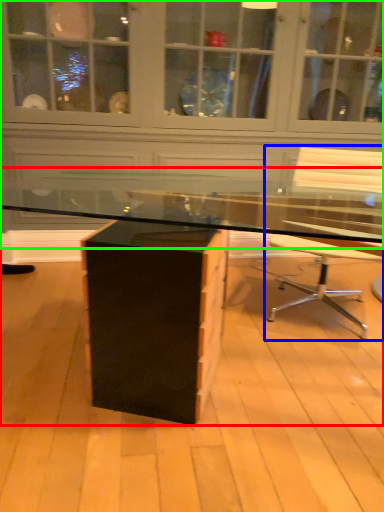
Question: Which object is positioned farthest from desk (highlighted by a red box)? Select from chair (highlighted by a blue box) and dresser (highlighted by a green box).

Choices:
 (A) chair
 (B) dresser

Answer: (B)